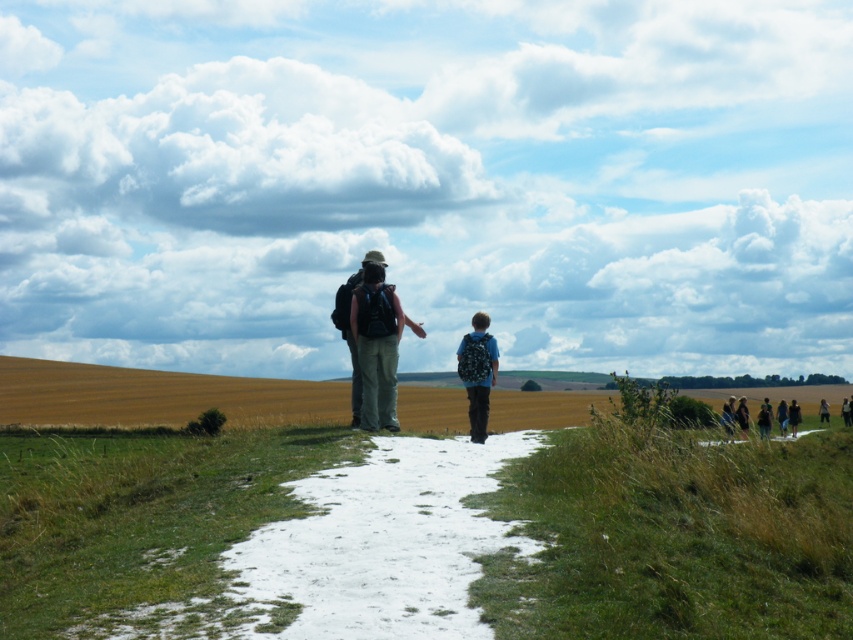
Which is more to the left, white snow at center or matte blue backpack at center?

From the viewer's perspective, white snow at center appears more on the left side.

Image resolution: width=853 pixels, height=640 pixels. What do you see at coordinates (381, 545) in the screenshot? I see `white snow at center` at bounding box center [381, 545].

What are the coordinates of `white snow at center` in the screenshot? It's located at (381, 545).

This screenshot has width=853, height=640. Identify the location of white snow at center. (381, 545).

Is white snow at center positioned in front of dark blue backpack at center?

Yes, it is.

The width and height of the screenshot is (853, 640). Find the location of `white snow at center`. white snow at center is located at coordinates (381, 545).

Locate an element on the screen. This screenshot has width=853, height=640. white snow at center is located at coordinates (381, 545).

In the scene shown: Does golden wheat field at center appear under matte black backpack at center?

Correct, golden wheat field at center is located below matte black backpack at center.

This screenshot has height=640, width=853. What do you see at coordinates (155, 396) in the screenshot? I see `golden wheat field at center` at bounding box center [155, 396].

The height and width of the screenshot is (640, 853). What do you see at coordinates (155, 396) in the screenshot?
I see `golden wheat field at center` at bounding box center [155, 396].

At what (x,y) coordinates should I click in order to perform the action: click on golden wheat field at center. Please return your answer as a coordinate pair (x, y). Looking at the image, I should click on (155, 396).